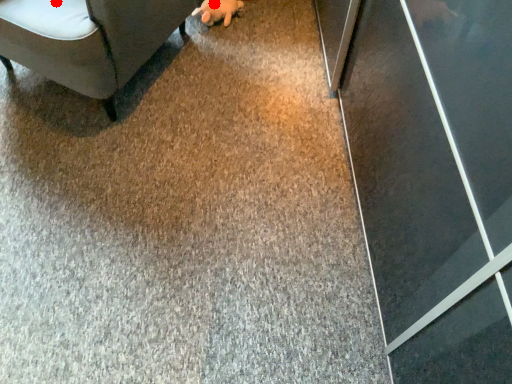
Question: Two points are circled on the image, labeled by A and B beside each circle. Which point is farther to the camera?

Choices:
 (A) A is further
 (B) B is further

Answer: (B)